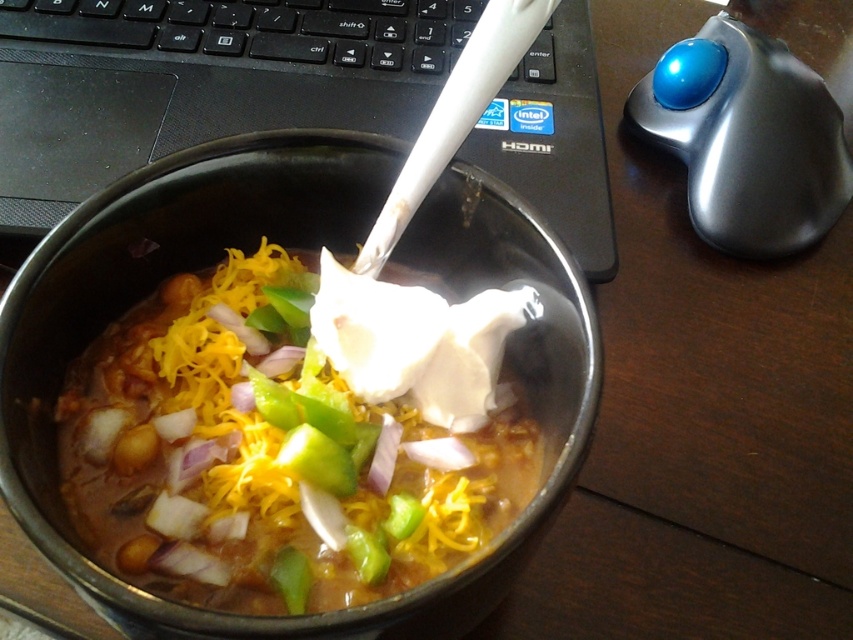
Is point (579, 211) positioned behind point (352, 42)?

No.

Image resolution: width=853 pixels, height=640 pixels. What are the coordinates of `black plastic laptop at upper left` in the screenshot? It's located at (199, 81).

The width and height of the screenshot is (853, 640). I want to click on black plastic laptop at upper left, so click(199, 81).

Can you confirm if smooth white cream at center is wider than metallic trackball at upper right?

Correct, the width of smooth white cream at center exceeds that of metallic trackball at upper right.

Which is above, smooth white cream at center or metallic trackball at upper right?

metallic trackball at upper right is above.

What are the coordinates of `smooth white cream at center` in the screenshot? It's located at (294, 435).

Find the location of a particular element. smooth white cream at center is located at coordinates (294, 435).

Is point (744, 45) farther from viewer compared to point (386, 38)?

That is False.

Is metallic trackball at upper right further to camera compared to black plastic keyboard at upper center?

No, it is in front of black plastic keyboard at upper center.

The height and width of the screenshot is (640, 853). What are the coordinates of `metallic trackball at upper right` in the screenshot? It's located at (746, 138).